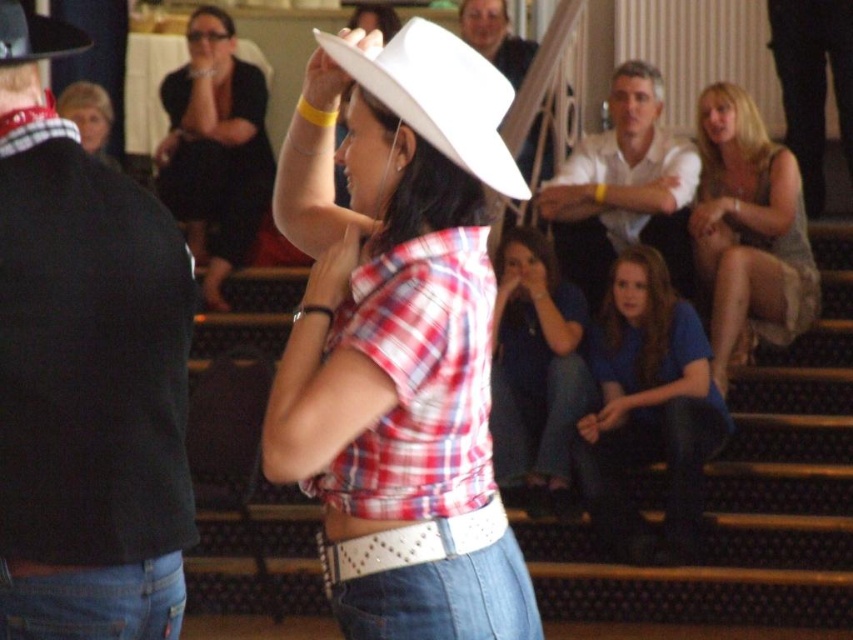
Is blue cotton shirt at lower center bigger than blue denim jeans at lower center?

Yes, blue cotton shirt at lower center is bigger than blue denim jeans at lower center.

Based on the photo, does blue cotton shirt at lower center appear on the left side of blue denim jeans at lower center?

In fact, blue cotton shirt at lower center is to the right of blue denim jeans at lower center.

Describe the element at coordinates (648, 406) in the screenshot. The image size is (853, 640). I see `blue cotton shirt at lower center` at that location.

Identify the location of blue cotton shirt at lower center. The width and height of the screenshot is (853, 640). (648, 406).

Between blue denim jeans at lower center and smooth white shirt at upper center, which one is positioned higher?

smooth white shirt at upper center is above.

Between blue denim jeans at lower center and smooth white shirt at upper center, which one appears on the right side from the viewer's perspective?

blue denim jeans at lower center is more to the right.

Between point (546, 310) and point (498, 51), which one is positioned behind?

Point (498, 51)

At what (x,y) coordinates should I click in order to perform the action: click on blue denim jeans at lower center. Please return your answer as a coordinate pair (x, y). The image size is (853, 640). Looking at the image, I should click on (535, 364).

Who is positioned more to the left, white matte cowboy hat at center or plaid fabric at center?

Positioned to the left is white matte cowboy hat at center.

Does white matte cowboy hat at center have a greater width compared to plaid fabric at center?

Correct, the width of white matte cowboy hat at center exceeds that of plaid fabric at center.

What are the coordinates of `white matte cowboy hat at center` in the screenshot? It's located at (398, 339).